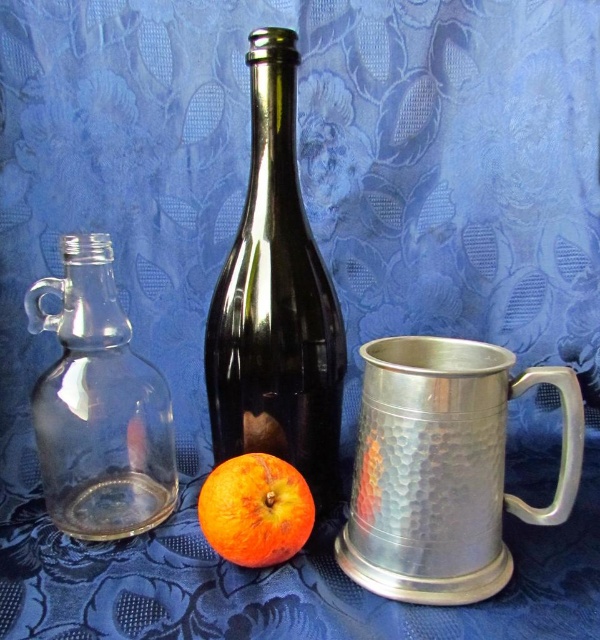
Between transparent glass carafe at left and orangesmoothorange at center, which one is positioned lower?

orangesmoothorange at center is below.

Does transparent glass carafe at left have a greater width compared to orangesmoothorange at center?

Yes, transparent glass carafe at left is wider than orangesmoothorange at center.

Is point (103, 540) closer to viewer compared to point (298, 544)?

No, (103, 540) is further to viewer.

What are the coordinates of `transparent glass carafe at left` in the screenshot? It's located at (99, 404).

Can you confirm if shiny dark glass bottle at center is smaller than transparent glass carafe at left?

No, shiny dark glass bottle at center is not smaller than transparent glass carafe at left.

Which of these two, shiny dark glass bottle at center or transparent glass carafe at left, stands taller?

Standing taller between the two is shiny dark glass bottle at center.

Who is more forward, (x=318, y=278) or (x=72, y=291)?

Point (x=72, y=291)

Find the location of a particular element. shiny dark glass bottle at center is located at coordinates (276, 300).

This screenshot has height=640, width=600. I want to click on shiny dark glass bottle at center, so click(x=276, y=300).

Who is more forward, (310, 248) or (235, 502)?

Point (235, 502) is more forward.

Locate an element on the screen. This screenshot has height=640, width=600. shiny dark glass bottle at center is located at coordinates (276, 300).